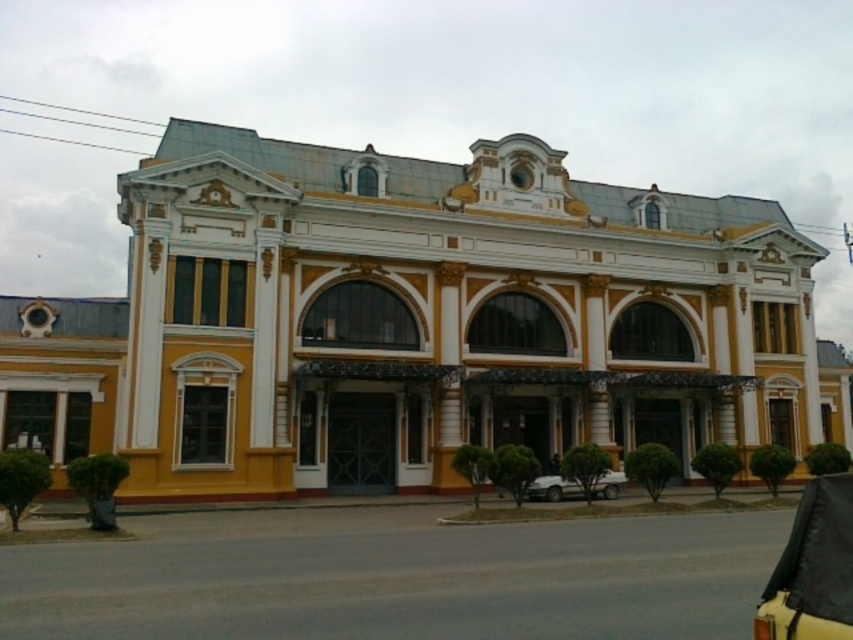
Is point (840, 589) in front of point (535, 483)?

That is True.

How far apart are yellow matte car at lower right and white matte car at lower center?

They are 15.24 meters apart.

Does point (763, 625) come behind point (576, 492)?

That is False.

Find the location of a particular element. yellow matte car at lower right is located at coordinates (811, 568).